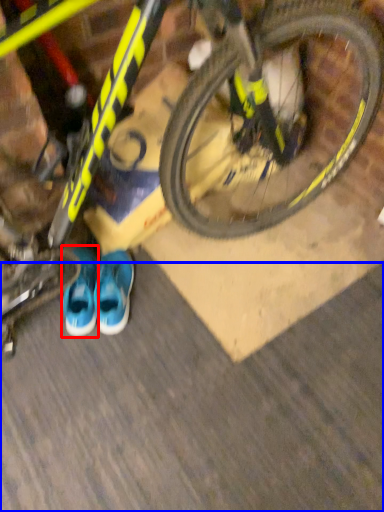
Question: Which of the following is the farthest to the observer, footwear (highlighted by a red box) or dirt track (highlighted by a blue box)?

Choices:
 (A) footwear
 (B) dirt track

Answer: (A)